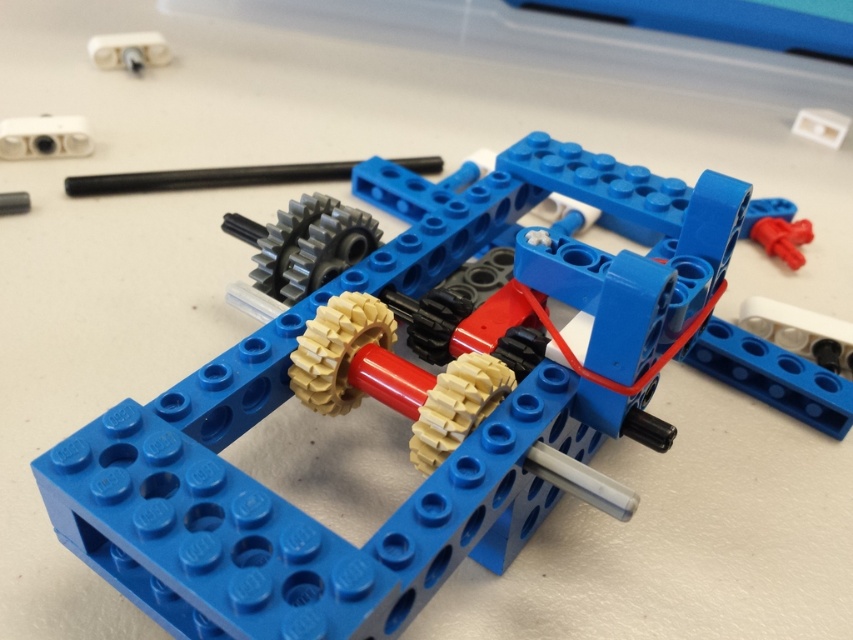
Question: Which point is farther to the camera?

Choices:
 (A) white plastic hinge at upper left
 (B) white plastic connector at upper left
 (C) white plastic hinge at upper right

Answer: (C)

Question: Which object is the closest to the white plastic hinge at upper left?

Choices:
 (A) white plastic connector at upper left
 (B) white plastic hinge at upper right

Answer: (A)

Question: Does white plastic connector at upper left have a smaller size compared to white plastic hinge at upper left?

Choices:
 (A) yes
 (B) no

Answer: (A)

Question: Does white plastic hinge at upper left lie in front of white plastic hinge at upper right?

Choices:
 (A) yes
 (B) no

Answer: (A)

Question: Which point is closer to the camera?

Choices:
 (A) (798, 112)
 (B) (125, 51)
 (C) (22, 141)

Answer: (C)

Question: Does white plastic connector at upper left appear over white plastic hinge at upper left?

Choices:
 (A) no
 (B) yes

Answer: (A)